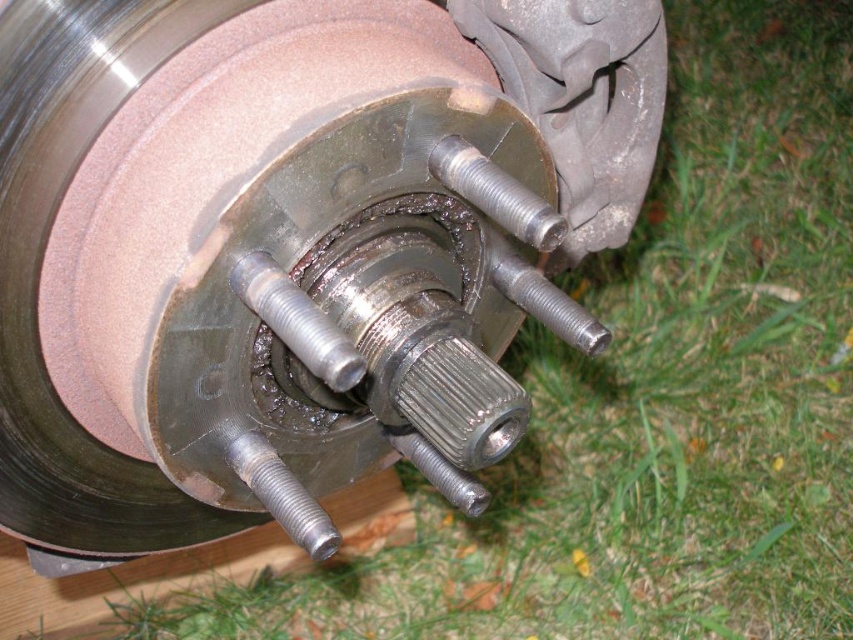
Question: Which point is farther to the camera?

Choices:
 (A) silver metallic bolt at center
 (B) metallic brake rotor at center

Answer: (A)

Question: Does metallic brake rotor at center have a larger size compared to silver metallic bolt at center?

Choices:
 (A) yes
 (B) no

Answer: (A)

Question: Does metallic brake rotor at center have a larger size compared to silver metallic bolt at center?

Choices:
 (A) no
 (B) yes

Answer: (B)

Question: Is metallic brake rotor at center to the right of silver metallic bolt at center from the viewer's perspective?

Choices:
 (A) no
 (B) yes

Answer: (A)